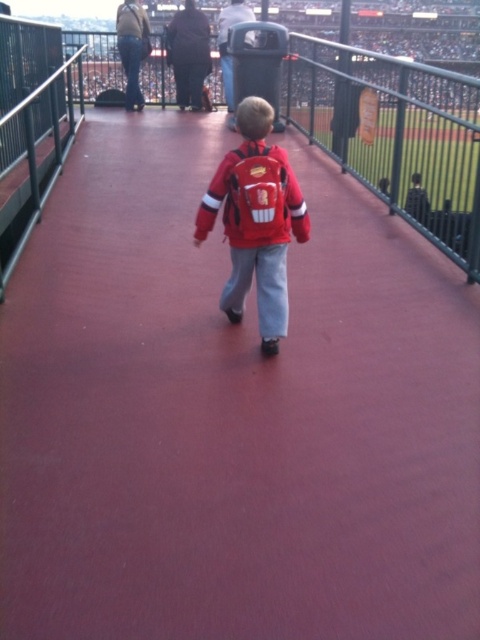
Question: Is metal/rail at left positioned before matte red jacket at center?

Choices:
 (A) yes
 (B) no

Answer: (B)

Question: Estimate the real-world distances between objects in this image. Which object is farther from the matte red jacket at center?

Choices:
 (A) matte red backpack at center
 (B) metal/rail at left

Answer: (B)

Question: Which point is closer to the camera?

Choices:
 (A) metal/rail at left
 (B) matte red backpack at center
 (C) matte red jacket at center

Answer: (C)

Question: From the image, what is the correct spatial relationship of matte red backpack at center in relation to metal/rail at left?

Choices:
 (A) right
 (B) left

Answer: (A)

Question: Which point is farther to the camera?

Choices:
 (A) (279, 173)
 (B) (48, 132)
 (C) (263, 163)

Answer: (B)

Question: Is matte red backpack at center positioned before matte red jacket at center?

Choices:
 (A) no
 (B) yes

Answer: (A)